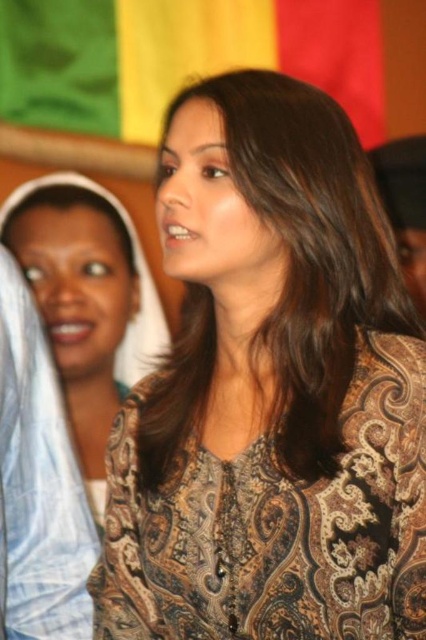
Question: Which point is farther to the camera?

Choices:
 (A) (345, 154)
 (B) (389, 404)
 (C) (91, 477)

Answer: (C)

Question: Is the position of brown paisley fabric dress at center more distant than that of paisley-patterned blouse at center?

Choices:
 (A) yes
 (B) no

Answer: (B)

Question: Can you confirm if brown paisley fabric dress at center is thinner than paisley-patterned blouse at center?

Choices:
 (A) yes
 (B) no

Answer: (B)

Question: Which of the following is the closest to the observer?

Choices:
 (A) (186, 570)
 (B) (150, 323)

Answer: (A)

Question: Is brown paisley fabric dress at center to the left of brown textured hair at center from the viewer's perspective?

Choices:
 (A) no
 (B) yes

Answer: (B)

Question: Which of the following is the closest to the observer?

Choices:
 (A) brown paisley fabric dress at center
 (B) brown textured hair at center

Answer: (A)